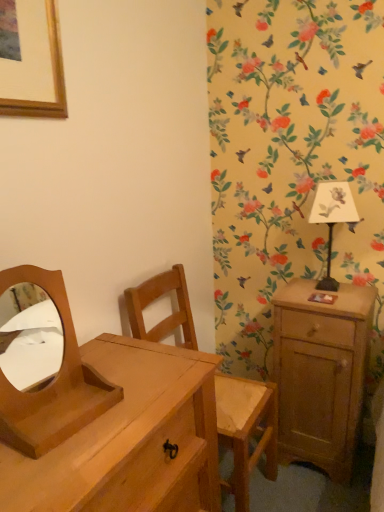
At what (x,y) coordinates should I click in order to perform the action: click on light brown wooden chest of drawers at lower left. Please return your answer as a coordinate pair (x, y). Looking at the image, I should click on (130, 439).

Find the location of a particular element. Image resolution: width=384 pixels, height=512 pixels. light brown wooden chest of drawers at lower left is located at coordinates (130, 439).

Can you confirm if white paper lampshade at upper right is smaller than light brown wooden chest of drawers at lower left?

Yes, white paper lampshade at upper right is smaller than light brown wooden chest of drawers at lower left.

From a real-world perspective, is white paper lampshade at upper right physically above light brown wooden chest of drawers at lower left?

Correct, in the physical world, white paper lampshade at upper right is higher than light brown wooden chest of drawers at lower left.

Which of these two, white paper lampshade at upper right or light brown wooden chest of drawers at lower left, is wider?

With larger width is light brown wooden chest of drawers at lower left.

Is white paper lampshade at upper right beside light brown wooden chest of drawers at lower left?

No, white paper lampshade at upper right is not with light brown wooden chest of drawers at lower left.

Considering the sizes of objects wooden/matte mirror at left and light brown wood nightstand at right in the image provided, who is smaller, wooden/matte mirror at left or light brown wood nightstand at right?

Smaller between the two is wooden/matte mirror at left.

Can you confirm if wooden/matte mirror at left is positioned to the left of light brown wood nightstand at right?

Correct, you'll find wooden/matte mirror at left to the left of light brown wood nightstand at right.

In the image, is wooden/matte mirror at left positioned in front of or behind light brown wood nightstand at right?

wooden/matte mirror at left is in front of light brown wood nightstand at right.

Considering the positions of points (65, 333) and (284, 372), is point (65, 333) farther from camera compared to point (284, 372)?

No, it is in front of (284, 372).

Considering the relative sizes of light brown wooden chest of drawers at lower left and white paper lampshade at upper right in the image provided, is light brown wooden chest of drawers at lower left wider than white paper lampshade at upper right?

Yes, light brown wooden chest of drawers at lower left is wider than white paper lampshade at upper right.

Consider the image. Is light brown wooden chest of drawers at lower left far away from white paper lampshade at upper right?

No, light brown wooden chest of drawers at lower left is in close proximity to white paper lampshade at upper right.

Does light brown wood nightstand at right have a greater height compared to wooden/matte mirror at left?

Yes.

From a real-world perspective, is light brown wood nightstand at right over wooden/matte mirror at left?

No, from a real-world perspective, light brown wood nightstand at right is not on top of wooden/matte mirror at left.

Is light brown wood nightstand at right at the right side of wooden/matte mirror at left?

Yes, light brown wood nightstand at right is to the right of wooden/matte mirror at left.

Is wooden swivel chair at center inside the boundaries of white paper lampshade at upper right, or outside?

wooden swivel chair at center cannot be found inside white paper lampshade at upper right.

Does wooden swivel chair at center touch white paper lampshade at upper right?

wooden swivel chair at center and white paper lampshade at upper right are clearly separated.

From the image's perspective, which object appears higher, wooden swivel chair at center or white paper lampshade at upper right?

white paper lampshade at upper right, from the image's perspective.

Which object is wider, wooden swivel chair at center or white paper lampshade at upper right?

With larger width is wooden swivel chair at center.

From the image's perspective, which is below, light brown wooden chest of drawers at lower left or light brown wood nightstand at right?

light brown wooden chest of drawers at lower left.

Is light brown wood nightstand at right located within light brown wooden chest of drawers at lower left?

Definitely not — light brown wood nightstand at right is not inside light brown wooden chest of drawers at lower left.

From a real-world perspective, is light brown wooden chest of drawers at lower left on light brown wood nightstand at right?

Yes, from a real-world perspective, light brown wooden chest of drawers at lower left is above light brown wood nightstand at right.

Can you see light brown wooden chest of drawers at lower left touching light brown wood nightstand at right?

No, light brown wooden chest of drawers at lower left is not beside light brown wood nightstand at right.

Does point (325, 203) come closer to viewer compared to point (2, 404)?

That is False.

Are white paper lampshade at upper right and wooden/matte mirror at left located far from each other?

Yes, white paper lampshade at upper right and wooden/matte mirror at left are located far from each other.

How many degrees apart are the facing directions of white paper lampshade at upper right and wooden/matte mirror at left?

81.5 degrees.

Is the position of white paper lampshade at upper right less distant than that of wooden/matte mirror at left?

No, the depth of white paper lampshade at upper right is greater than that of wooden/matte mirror at left.

You are a GUI agent. You are given a task and a screenshot of the screen. Output one action in this format:
    pyautogui.click(x=<x>, y=<y>)
    Task: Click on the bedside lamp that appears behind the light brown wooden chest of drawers at lower left
    The height and width of the screenshot is (512, 384).
    Given the screenshot: What is the action you would take?
    pyautogui.click(x=332, y=218)

Locate an element on the screen. This screenshot has height=512, width=384. nightstand lying on the right of wooden/matte mirror at left is located at coordinates (321, 373).

Which object lies nearer to the anchor point white paper lampshade at upper right, light brown wooden chest of drawers at lower left or wooden/matte mirror at left?

The object closer to white paper lampshade at upper right is light brown wooden chest of drawers at lower left.

Estimate the real-world distances between objects in this image. Which object is further from wooden/matte mirror at left, white paper lampshade at upper right or light brown wooden chest of drawers at lower left?

Among the two, white paper lampshade at upper right is located further to wooden/matte mirror at left.

Which object lies further to the anchor point light brown wooden chest of drawers at lower left, wooden swivel chair at center or white paper lampshade at upper right?

white paper lampshade at upper right lies further to light brown wooden chest of drawers at lower left than the other object.

From the image, which object appears to be nearer to light brown wood nightstand at right, light brown wooden chest of drawers at lower left or white paper lampshade at upper right?

The object closer to light brown wood nightstand at right is white paper lampshade at upper right.

Considering their positions, is wooden/matte mirror at left positioned closer to white paper lampshade at upper right than light brown wooden chest of drawers at lower left?

light brown wooden chest of drawers at lower left is positioned closer to the anchor white paper lampshade at upper right.

Based on their spatial positions, is wooden swivel chair at center or light brown wooden chest of drawers at lower left closer to white paper lampshade at upper right?

The object closer to white paper lampshade at upper right is wooden swivel chair at center.

From the image, which object appears to be nearer to light brown wood nightstand at right, light brown wooden chest of drawers at lower left or wooden swivel chair at center?

Based on the image, wooden swivel chair at center appears to be nearer to light brown wood nightstand at right.

Looking at the image, which one is located further to light brown wooden chest of drawers at lower left, wooden/matte mirror at left or wooden swivel chair at center?

The object further to light brown wooden chest of drawers at lower left is wooden swivel chair at center.

The width and height of the screenshot is (384, 512). In order to click on mirror between light brown wooden chest of drawers at lower left and wooden swivel chair at center along the z-axis in this screenshot , I will do `click(52, 383)`.

This screenshot has height=512, width=384. What are the coordinates of `the chest of drawers located between wooden/matte mirror at left and light brown wood nightstand at right in the left-right direction` in the screenshot? It's located at (130, 439).

What are the coordinates of `swivel chair between wooden/matte mirror at left and white paper lampshade at upper right` in the screenshot? It's located at (246, 430).

The width and height of the screenshot is (384, 512). What are the coordinates of `mirror located between light brown wooden chest of drawers at lower left and white paper lampshade at upper right in the depth direction` in the screenshot? It's located at (52, 383).